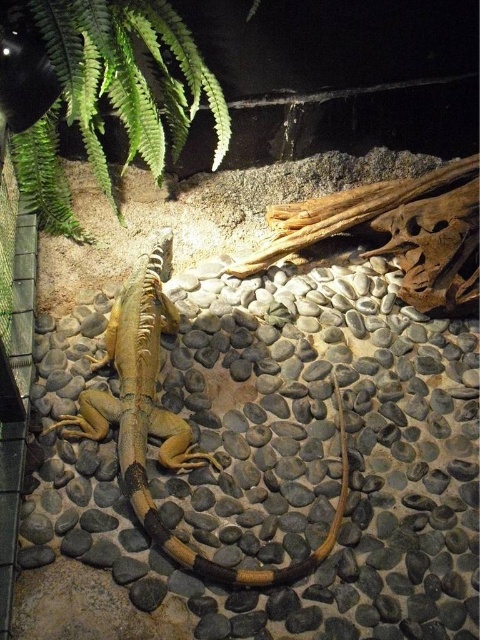
Does green leafy plant at upper left appear under smooth tan lizard at center?

No.

Is green leafy plant at upper left positioned behind smooth tan lizard at center?

That is False.

What do you see at coordinates (97, 90) in the screenshot?
I see `green leafy plant at upper left` at bounding box center [97, 90].

Where is `green leafy plant at upper left`? green leafy plant at upper left is located at coordinates (97, 90).